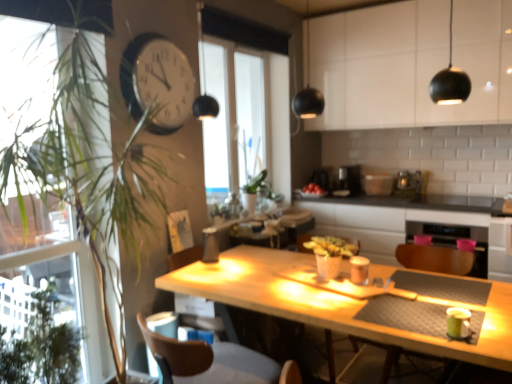
Image resolution: width=512 pixels, height=384 pixels. Describe the element at coordinates (435, 259) in the screenshot. I see `wooden armchair at right` at that location.

Where is `brown leather swivel chair at lower left`? Image resolution: width=512 pixels, height=384 pixels. brown leather swivel chair at lower left is located at coordinates (214, 362).

This screenshot has width=512, height=384. I want to click on transparent glass window at center, so click(x=247, y=97).

What is the approximate height of green leafy plant at left?

It is 7.33 feet.

This screenshot has height=384, width=512. Describe the element at coordinates (150, 187) in the screenshot. I see `green leafy plant at left` at that location.

What do you see at coordinates (408, 184) in the screenshot?
I see `satin silver toaster at center, arranged as the 1th appliance when viewed from the right` at bounding box center [408, 184].

Find the location of a particular element. Image resolution: width=512 pixels, height=384 pixels. white glossy clock at upper center is located at coordinates (157, 81).

Measure the distance between white glossy clock at upper center and black plastic coffee maker at center, acting as the 2th appliance starting from the right.

The distance of white glossy clock at upper center from black plastic coffee maker at center, acting as the 2th appliance starting from the right, is 2.39 meters.

From a real-world perspective, which object rests below the other?

From a 3D spatial view, black plastic coffee maker at center, acting as the 2th appliance starting from the right, is below.

Is white glossy clock at upper center bigger or smaller than black plastic coffee maker at center, acting as the 2th appliance starting from the right?

white glossy clock at upper center is bigger than black plastic coffee maker at center, acting as the 2th appliance starting from the right.

From a real-world perspective, who is located lower, green leafy plant at left or green leafy plant at left?

green leafy plant at left, from a real-world perspective.

Is green leafy plant at left located within green leafy plant at left?

Yes.

Who is bigger, green leafy plant at left or green leafy plant at left?

Bigger between the two is green leafy plant at left.

Can you confirm if satin silver toaster at center, marked as the second appliance in a left-to-right arrangement, is bigger than wooden armchair at right?

No, satin silver toaster at center, marked as the second appliance in a left-to-right arrangement, is not bigger than wooden armchair at right.

Is satin silver toaster at center, marked as the second appliance in a left-to-right arrangement, closer to camera compared to wooden armchair at right?

No, satin silver toaster at center, marked as the second appliance in a left-to-right arrangement, is further to the viewer.

From a real-world perspective, which is physically below, satin silver toaster at center, arranged as the 1th appliance when viewed from the right, or wooden armchair at right?

wooden armchair at right.

How distant is white glossy clock at upper center from green leafy plant at left?

white glossy clock at upper center is 10.25 inches from green leafy plant at left.

Is white glossy clock at upper center further to camera compared to green leafy plant at left?

Yes, it is.

In the scene shown: Is white glossy clock at upper center spatially inside green leafy plant at left, or outside of it?

white glossy clock at upper center is spatially situated outside green leafy plant at left.

Based on the photo, is there a large distance between white glossy clock at upper center and green leafy plant at left?

white glossy clock at upper center is near green leafy plant at left, not far away.

Image resolution: width=512 pixels, height=384 pixels. In order to click on clock above the black matte counter at center (from a real-world perspective) in this screenshot , I will do `click(157, 81)`.

Could black matte counter at center be considered to be inside white glossy clock at upper center?

No.

Considering the positions of objects white glossy clock at upper center and black matte counter at center in the image provided, who is more to the left, white glossy clock at upper center or black matte counter at center?

Positioned to the left is white glossy clock at upper center.

Relative to black plastic coffee maker at center, acting as the 2th appliance starting from the right, is satin silver toaster at center, marked as the second appliance in a left-to-right arrangement, in front or behind?

Visually, satin silver toaster at center, marked as the second appliance in a left-to-right arrangement, is located behind black plastic coffee maker at center, acting as the 2th appliance starting from the right.

Would you say satin silver toaster at center, marked as the second appliance in a left-to-right arrangement, is a long distance from black plastic coffee maker at center, acting as the 2th appliance starting from the right?

satin silver toaster at center, marked as the second appliance in a left-to-right arrangement, is actually quite close to black plastic coffee maker at center, acting as the 2th appliance starting from the right.

Is black plastic coffee maker at center, which is the first appliance from left to right, inside satin silver toaster at center, marked as the second appliance in a left-to-right arrangement?

That's incorrect, black plastic coffee maker at center, which is the first appliance from left to right, is not inside satin silver toaster at center, marked as the second appliance in a left-to-right arrangement.

Find the location of a particular element. appliance on the left of satin silver toaster at center, arranged as the 1th appliance when viewed from the right is located at coordinates (350, 178).

Which is behind, green leafy plant at left or wooden armchair at right?

wooden armchair at right is behind.

Considering the positions of points (75, 341) and (469, 262), is point (75, 341) closer to camera compared to point (469, 262)?

Yes, it is in front of point (469, 262).

From a real-world perspective, is green leafy plant at left below wooden armchair at right?

No.

The height and width of the screenshot is (384, 512). What are the coordinates of `clock that is above the black plastic coffee maker at center, acting as the 2th appliance starting from the right (from the image's perspective)` in the screenshot? It's located at (157, 81).

Locate an element on the screen. houseplant lying on the right of green leafy plant at left is located at coordinates (150, 187).

Based on their spatial positions, is satin silver toaster at center, marked as the second appliance in a left-to-right arrangement, or green leafy plant at left closer to brown leather swivel chair at lower left?

green leafy plant at left is closer to brown leather swivel chair at lower left.

From the image, which object appears to be farther from black matte counter at center, red matte tomatoes at center or white glossy cabinet at upper center?

white glossy cabinet at upper center lies further to black matte counter at center than the other object.

Considering their positions, is wooden armchair at right positioned closer to satin silver toaster at center, arranged as the 1th appliance when viewed from the right, than transparent glass window at center?

wooden armchair at right.

Looking at this image, from the image, which object appears to be farther from black matte counter at center, red matte tomatoes at center or green leafy plant at left?

Based on the image, green leafy plant at left appears to be further to black matte counter at center.

Considering their positions, is wooden armchair at right positioned closer to green leafy plant at left than black plastic coffee maker at center, acting as the 2th appliance starting from the right?

wooden armchair at right lies closer to green leafy plant at left than the other object.

Looking at the image, which one is located further to brown leather swivel chair at lower left, black plastic coffee maker at center, acting as the 2th appliance starting from the right, or green leafy plant at left?

black plastic coffee maker at center, acting as the 2th appliance starting from the right, is further to brown leather swivel chair at lower left.

From the image, which object appears to be nearer to green leafy plant at left, satin silver toaster at center, marked as the second appliance in a left-to-right arrangement, or wooden armchair at right?

The object closer to green leafy plant at left is wooden armchair at right.

Looking at the image, which one is located closer to wooden armchair at right, black matte counter at center or red matte tomatoes at center?

black matte counter at center.

Locate an element on the screen. Image resolution: width=512 pixels, height=384 pixels. fruit located between white glossy clock at upper center and black matte counter at center in the left-right direction is located at coordinates (313, 189).

Locate an element on the screen. counter between brown leather swivel chair at lower left and red matte tomatoes at center in the front-back direction is located at coordinates (410, 223).

The height and width of the screenshot is (384, 512). I want to click on appliance between red matte tomatoes at center and satin silver toaster at center, marked as the second appliance in a left-to-right arrangement, from left to right, so 350,178.

Where is `fruit between transparent glass window at center and black matte counter at center in the horizontal direction`? The width and height of the screenshot is (512, 384). fruit between transparent glass window at center and black matte counter at center in the horizontal direction is located at coordinates (313, 189).